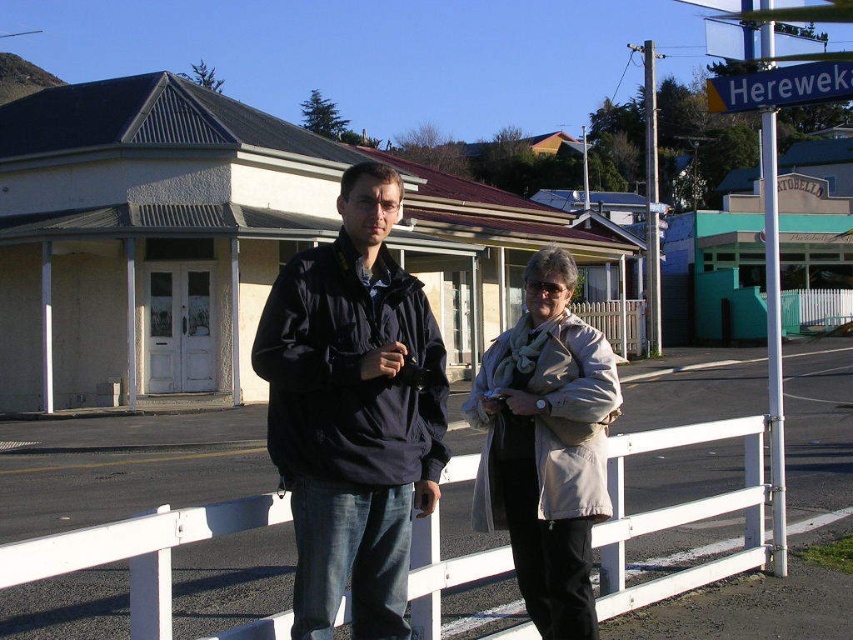
You are a delivery person trying to place a package between the white plastic rail at center and the beige fabric coat at center. Based on their widths, can you fit the package between them?

The white plastic rail at center might be wider than beige fabric coat at center, so there may be enough space to fit the package between them.

You are standing on the street corner and want to take a photo of the dark blue jacket at center. If your camera has a maximum focus range of 3 meters, will you be able to capture it clearly?

The dark blue jacket at center is 3.19 meters away from you. Since your camera can only focus up to 3 meters, you won

You are a photographer trying to capture both the dark blue jacket at center and the beige fabric coat at center in a single frame. Given that your camera has a minimum focus distance of 30 inches, will you be able to capture both subjects clearly without moving the camera?

The dark blue jacket at center and beige fabric coat at center are 32.04 inches apart from each other. Since the distance between them is greater than the camera minimum focus distance of 30 inches, the photographer can capture both subjects clearly in a single frame without moving the camera.